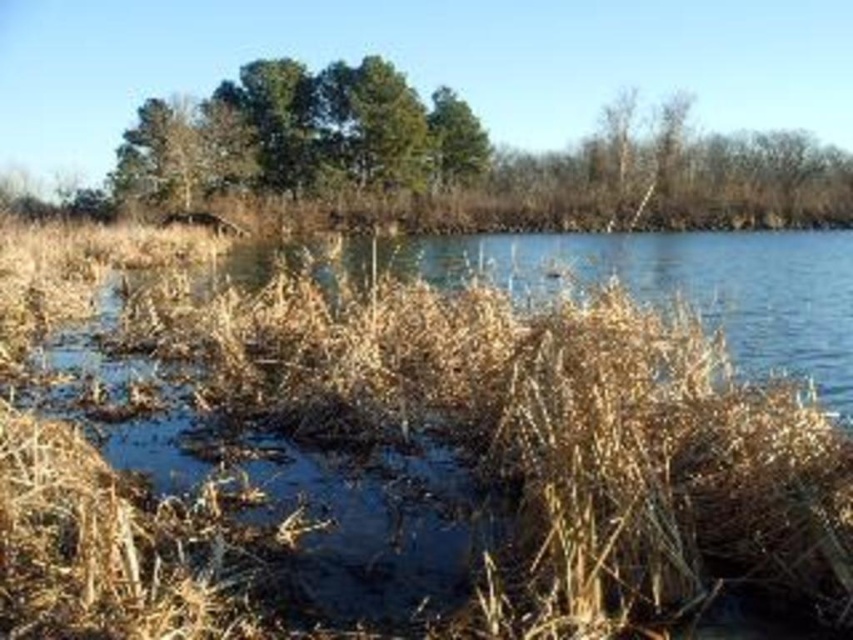
Question: Does brown grassy river at center appear under green leafy trees at upper center?

Choices:
 (A) yes
 (B) no

Answer: (A)

Question: Which point appears farthest from the camera in this image?

Choices:
 (A) (662, 323)
 (B) (335, 150)

Answer: (B)

Question: Which point is farther from the camera taking this photo?

Choices:
 (A) (509, 410)
 (B) (459, 131)

Answer: (B)

Question: Can you confirm if brown grassy river at center is thinner than green leafy trees at upper center?

Choices:
 (A) no
 (B) yes

Answer: (B)

Question: Is brown grassy river at center above green leafy trees at upper center?

Choices:
 (A) yes
 (B) no

Answer: (B)